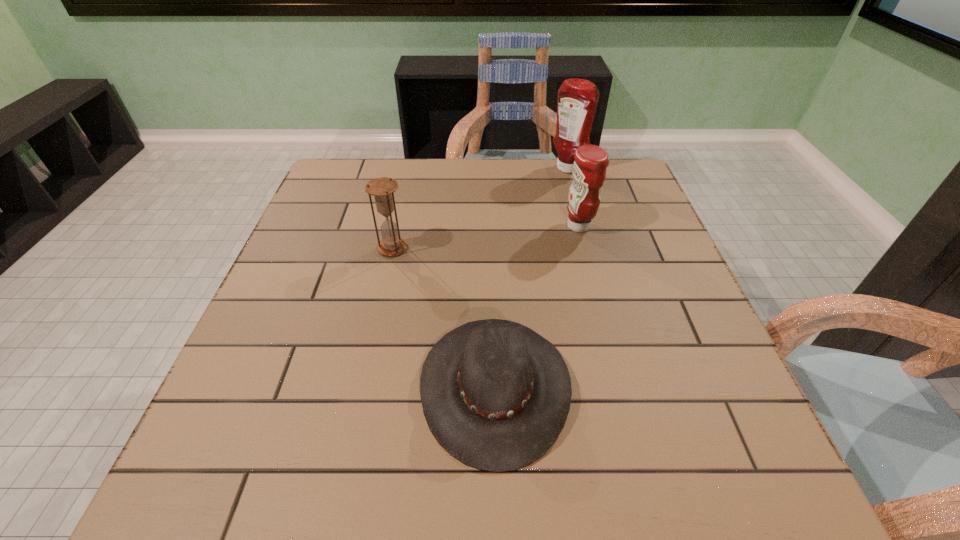
Locate an element on the screen. The height and width of the screenshot is (540, 960). free spot located on the front-facing side of the second object from left to right is located at coordinates (366, 387).

This screenshot has width=960, height=540. I want to click on vacant area situated on the front-facing side of the second object from left to right, so click(x=287, y=387).

In order to click on vacant region located 0.260m on the front-facing side of the second object from left to right in this screenshot , I will do `click(276, 387)`.

Locate an element on the screen. This screenshot has width=960, height=540. object that is positioned at the far edge is located at coordinates (577, 98).

Locate an element on the screen. Image resolution: width=960 pixels, height=540 pixels. object present at the near edge is located at coordinates pyautogui.click(x=495, y=394).

The width and height of the screenshot is (960, 540). I want to click on object situated at the right edge, so click(577, 98).

At what (x,y) coordinates should I click in order to perform the action: click on object that is at the far right corner. Please return your answer as a coordinate pair (x, y). Image resolution: width=960 pixels, height=540 pixels. Looking at the image, I should click on (577, 98).

The height and width of the screenshot is (540, 960). In order to click on free space at the far edge in this screenshot , I will do `click(420, 180)`.

Locate an element on the screen. free spot at the left edge of the desktop is located at coordinates pos(240,438).

In the image, there is a desktop. Find the location of `vacant space at the right edge`. vacant space at the right edge is located at coordinates (656, 323).